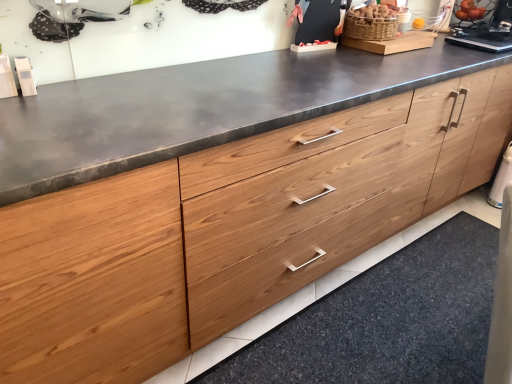
Where is `vacant space underneath natural wood drawer at lower center (from a real-world perspective)`? vacant space underneath natural wood drawer at lower center (from a real-world perspective) is located at coordinates (409, 310).